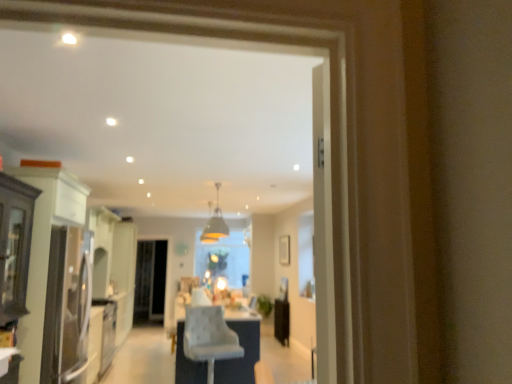
Question: Considering their positions, is clear glass screen door at center located in front of or behind matte gold pendant light at center?

Choices:
 (A) behind
 (B) front

Answer: (A)

Question: From their relative heights in the image, would you say clear glass screen door at center is taller or shorter than matte gold pendant light at center?

Choices:
 (A) tall
 (B) short

Answer: (A)

Question: Which object is positioned farthest from the light gray fabric chair at center?

Choices:
 (A) clear glass screen door at center
 (B) matte gold pendant light at center
 (C) matte white cabinet at left

Answer: (A)

Question: Which is farther from the matte gold pendant light at center?

Choices:
 (A) matte white cabinet at left
 (B) clear glass screen door at center
 (C) light gray fabric chair at center

Answer: (A)